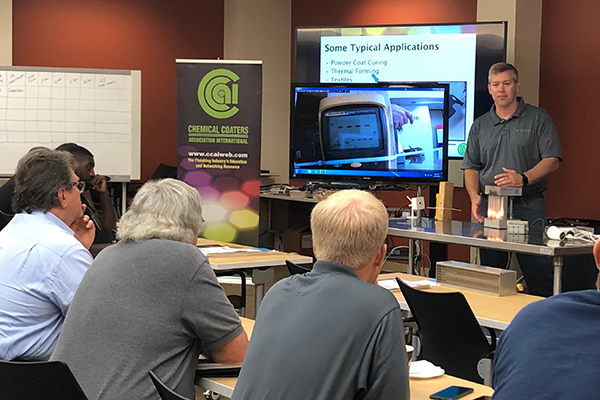
This screenshot has height=400, width=600. I want to click on black chair, so click(x=454, y=335), click(x=18, y=385), click(x=169, y=395).